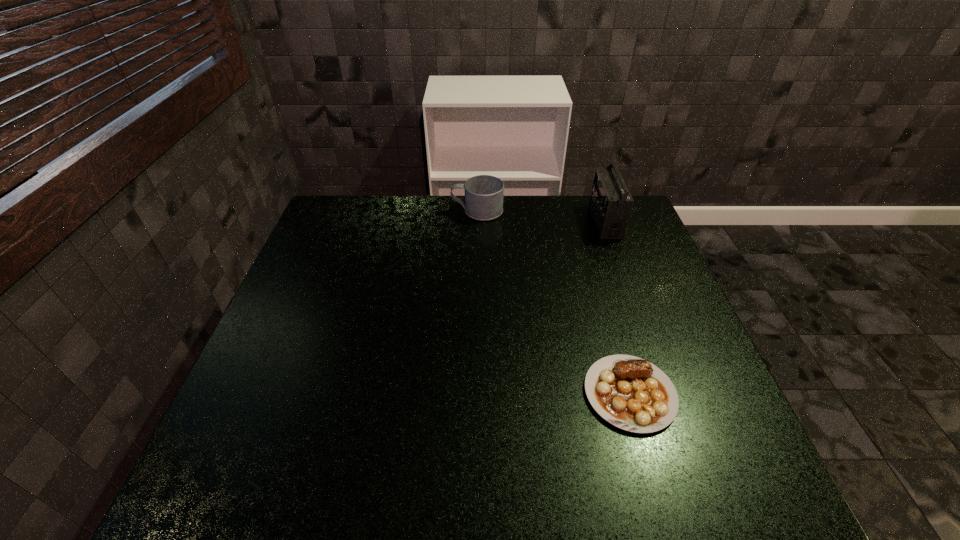
At what (x,y) coordinates should I click in order to perform the action: click on blank space at the right edge of the desktop. Please return your answer as a coordinate pair (x, y). Image resolution: width=960 pixels, height=540 pixels. Looking at the image, I should click on (700, 412).

Image resolution: width=960 pixels, height=540 pixels. In the image, there is a desktop. In order to click on free space at the near left corner in this screenshot , I will do `click(257, 478)`.

Identify the location of free space at the near right corner. The height and width of the screenshot is (540, 960). (745, 494).

Find the location of a particular element. This screenshot has height=540, width=960. free space between the nearest object and the tallest object is located at coordinates (617, 307).

You are a GUI agent. You are given a task and a screenshot of the screen. Output one action in this format:
    pyautogui.click(x=<x>, y=<y>)
    Task: Click on the empty space between the tallest object and the nearest object
    The width and height of the screenshot is (960, 540).
    Given the screenshot: What is the action you would take?
    pyautogui.click(x=617, y=307)

Where is `vacant region between the tallest object and the leftmost object`? The height and width of the screenshot is (540, 960). vacant region between the tallest object and the leftmost object is located at coordinates (541, 216).

Find the location of `free spot between the steak and the mug`. free spot between the steak and the mug is located at coordinates (554, 302).

At what (x,y) coordinates should I click in order to perform the action: click on free space between the steak and the second tallest object. Please return your answer as a coordinate pair (x, y). Looking at the image, I should click on (554, 302).

At what (x,y) coordinates should I click in order to perform the action: click on unoccupied area between the steak and the second tallest object. Please return your answer as a coordinate pair (x, y). Image resolution: width=960 pixels, height=540 pixels. Looking at the image, I should click on point(554,302).

At what (x,y) coordinates should I click in order to perform the action: click on free point between the second tallest object and the tallest object. Please return your answer as a coordinate pair (x, y). Looking at the image, I should click on pyautogui.click(x=541, y=216).